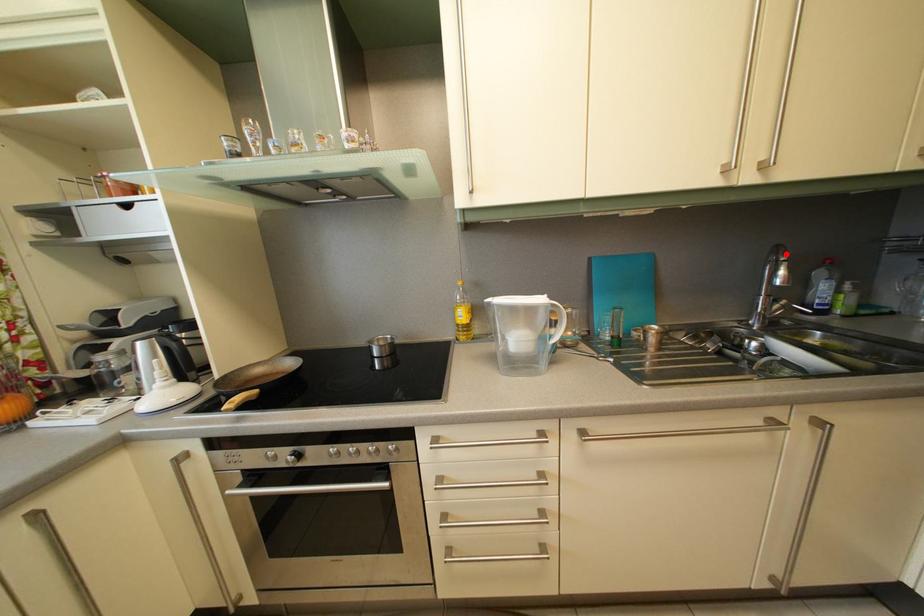
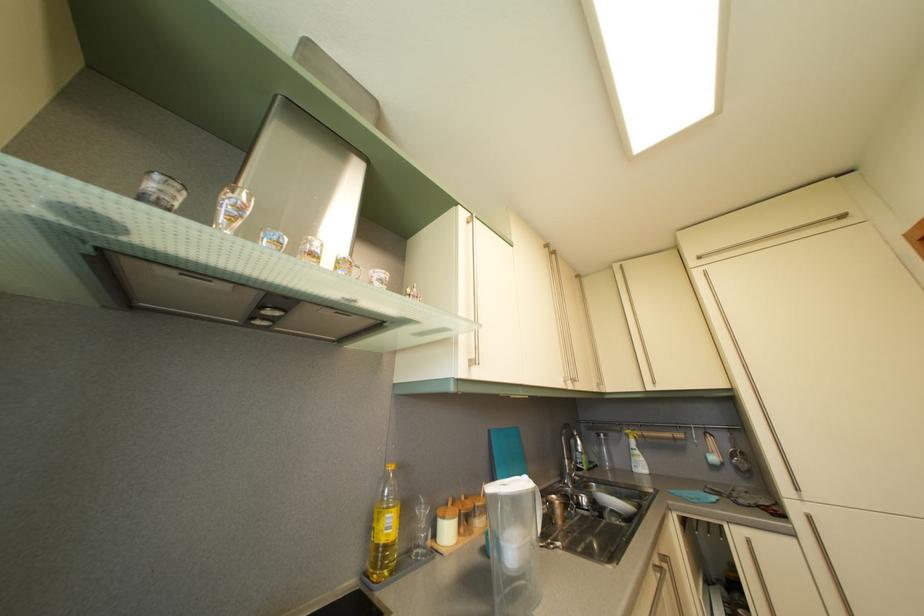
Question: I am providing you with two images of the same scene from different viewpoints. Image1 has a red point marked. In image2, the corresponding 3D location appears at what relative position? Reply with the corresponding letter.

Choices:
 (A) Closer
 (B) Farther

Answer: (B)